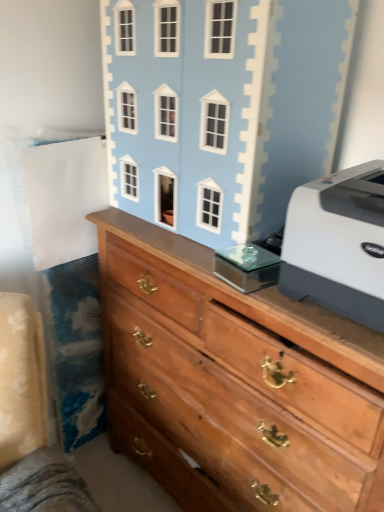
Image resolution: width=384 pixels, height=512 pixels. What do you see at coordinates (234, 382) in the screenshot?
I see `wooden chest of drawers at center` at bounding box center [234, 382].

What is the approximate height of white plastic printer at right?

The height of white plastic printer at right is 25.20 centimeters.

Locate an element on the screen. wooden chest of drawers at center is located at coordinates (234, 382).

How different are the orientations of white plastic printer at right and light blue painted wood dollhouse at upper center in degrees?

white plastic printer at right and light blue painted wood dollhouse at upper center are facing 0.65 degrees away from each other.

Which object is wider, white plastic printer at right or light blue painted wood dollhouse at upper center?

white plastic printer at right.

Identify the location of toy behind the white plastic printer at right. (189, 111).

Is point (320, 238) closer to viewer compared to point (160, 208)?

Yes, it is.

Is wooden chest of drawers at center in front of or behind white plastic printer at right in the image?

Visually, wooden chest of drawers at center is located in front of white plastic printer at right.

Consider the image. Is wooden chest of drawers at center looking in the opposite direction of white plastic printer at right?

wooden chest of drawers at center does not have its back to white plastic printer at right.

Is wooden chest of drawers at center with white plastic printer at right?

No, wooden chest of drawers at center is not touching white plastic printer at right.

Considering the relative positions of wooden chest of drawers at center and white plastic printer at right in the image provided, is wooden chest of drawers at center to the left of white plastic printer at right from the viewer's perspective?

Correct, you'll find wooden chest of drawers at center to the left of white plastic printer at right.

Based on the photo, is light blue painted wood dollhouse at upper center taller than wooden chest of drawers at center?

No, light blue painted wood dollhouse at upper center is not taller than wooden chest of drawers at center.

Can you tell me how much light blue painted wood dollhouse at upper center and wooden chest of drawers at center differ in facing direction?

The angle between the facing direction of light blue painted wood dollhouse at upper center and the facing direction of wooden chest of drawers at center is 1.47 degrees.

Which is in front, light blue painted wood dollhouse at upper center or wooden chest of drawers at center?

Positioned in front is wooden chest of drawers at center.

From the image's perspective, which is above, light blue painted wood dollhouse at upper center or wooden chest of drawers at center?

From the image's view, light blue painted wood dollhouse at upper center is above.

Which object is further away from the camera taking this photo, wooden chest of drawers at center or light blue painted wood dollhouse at upper center?

light blue painted wood dollhouse at upper center.

Is wooden chest of drawers at center situated inside light blue painted wood dollhouse at upper center or outside?

wooden chest of drawers at center is spatially situated outside light blue painted wood dollhouse at upper center.

Considering the relative sizes of wooden chest of drawers at center and light blue painted wood dollhouse at upper center in the image provided, is wooden chest of drawers at center bigger than light blue painted wood dollhouse at upper center?

Correct, wooden chest of drawers at center is larger in size than light blue painted wood dollhouse at upper center.

Is white plastic printer at right oriented towards wooden chest of drawers at center?

No, white plastic printer at right is not aimed at wooden chest of drawers at center.

Is white plastic printer at right inside or outside of wooden chest of drawers at center?

white plastic printer at right is not enclosed by wooden chest of drawers at center.

Is white plastic printer at right bigger or smaller than wooden chest of drawers at center?

Considering their sizes, white plastic printer at right takes up less space than wooden chest of drawers at center.

Identify the location of printer behind the wooden chest of drawers at center. The width and height of the screenshot is (384, 512). (338, 244).

Is light blue painted wood dollhouse at upper center looking in the opposite direction of white plastic printer at right?

No, light blue painted wood dollhouse at upper center is not facing the opposite direction of white plastic printer at right.

Where is `printer located in front of the light blue painted wood dollhouse at upper center`? printer located in front of the light blue painted wood dollhouse at upper center is located at coordinates (338, 244).

Is light blue painted wood dollhouse at upper center wider than white plastic printer at right?

Incorrect, the width of light blue painted wood dollhouse at upper center does not surpass that of white plastic printer at right.

Locate an element on the screen. The height and width of the screenshot is (512, 384). toy on the left of white plastic printer at right is located at coordinates (189, 111).

Identify the location of printer located behind the wooden chest of drawers at center. The image size is (384, 512). (338, 244).

Looking at the image, which one is located further to light blue painted wood dollhouse at upper center, wooden chest of drawers at center or white plastic printer at right?

Among the two, white plastic printer at right is located further to light blue painted wood dollhouse at upper center.

When comparing their distances from wooden chest of drawers at center, does white plastic printer at right or light blue painted wood dollhouse at upper center seem closer?

white plastic printer at right lies closer to wooden chest of drawers at center than the other object.

When comparing their distances from white plastic printer at right, does light blue painted wood dollhouse at upper center or wooden chest of drawers at center seem further?

Among the two, light blue painted wood dollhouse at upper center is located further to white plastic printer at right.

Which object lies further to the anchor point white plastic printer at right, wooden chest of drawers at center or light blue painted wood dollhouse at upper center?

light blue painted wood dollhouse at upper center is further to white plastic printer at right.

When comparing their distances from light blue painted wood dollhouse at upper center, does white plastic printer at right or wooden chest of drawers at center seem closer?

wooden chest of drawers at center lies closer to light blue painted wood dollhouse at upper center than the other object.

Looking at this image, considering their positions, is light blue painted wood dollhouse at upper center positioned closer to wooden chest of drawers at center than white plastic printer at right?

white plastic printer at right.

I want to click on printer between light blue painted wood dollhouse at upper center and wooden chest of drawers at center in the up-down direction, so click(338, 244).